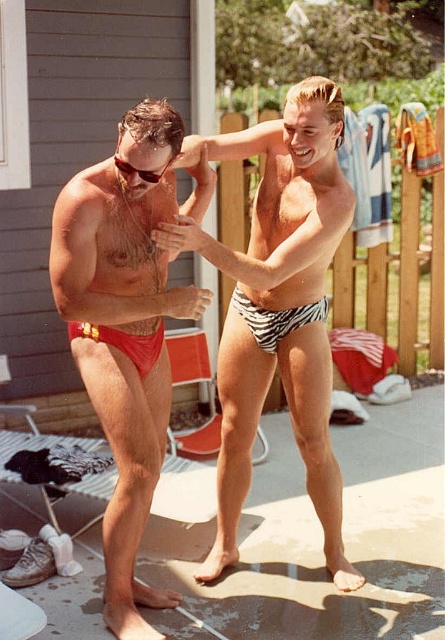
Question: Where is matte red swim trunks at left located in relation to matte red bikini bottom at lower left in the image?

Choices:
 (A) left
 (B) right

Answer: (B)

Question: Is matte red swim trunks at left above matte black sunglasses at upper center?

Choices:
 (A) no
 (B) yes

Answer: (A)

Question: Considering the real-world distances, which object is farthest from the matte black sunglasses at upper center?

Choices:
 (A) matte red swim trunks at left
 (B) matte red bikini bottom at lower left

Answer: (B)

Question: Which of these objects is positioned farthest from the matte red bikini bottom at lower left?

Choices:
 (A) matte red swim trunks at left
 (B) matte black sunglasses at upper center

Answer: (B)

Question: Which is farther from the matte red swim trunks at left?

Choices:
 (A) matte black sunglasses at upper center
 (B) matte red bikini bottom at lower left

Answer: (A)

Question: Can you confirm if matte red bikini bottom at lower left is positioned to the right of matte black sunglasses at upper center?

Choices:
 (A) no
 (B) yes

Answer: (A)